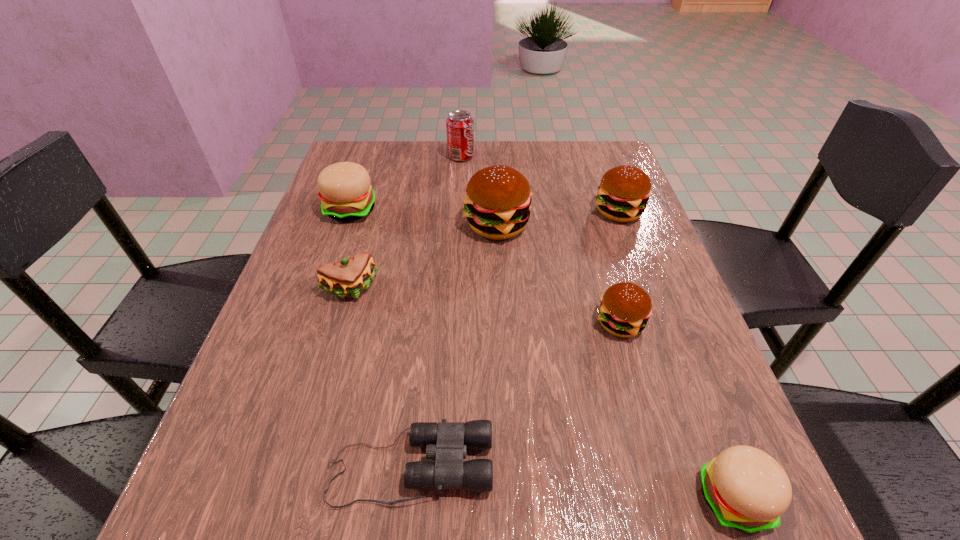
Find the location of a particular element. Image resolution: width=960 pixels, height=540 pixels. object present at the far edge is located at coordinates (459, 125).

Identify the location of hamburger at the near edge. (747, 489).

Identify the location of binoculars that is at the near edge. 447,442.

The height and width of the screenshot is (540, 960). I want to click on hamburger that is at the left edge, so click(345, 192).

Locate an element on the screen. The image size is (960, 540). sandwich that is at the left edge is located at coordinates (350, 277).

The width and height of the screenshot is (960, 540). I want to click on object that is at the near right corner, so click(747, 489).

Locate an element on the screen. The image size is (960, 540). vacant area at the far edge of the desktop is located at coordinates (444, 164).

At what (x,y) coordinates should I click in order to perform the action: click on vacant space at the left edge of the desktop. Please return your answer as a coordinate pair (x, y). Looking at the image, I should click on (300, 405).

At what (x,y) coordinates should I click in order to perform the action: click on vacant space at the right edge of the desktop. Please return your answer as a coordinate pair (x, y). Looking at the image, I should click on (661, 279).

Find the location of `vacant area that lies between the left beige hamburger and the farthest object`. vacant area that lies between the left beige hamburger and the farthest object is located at coordinates (406, 183).